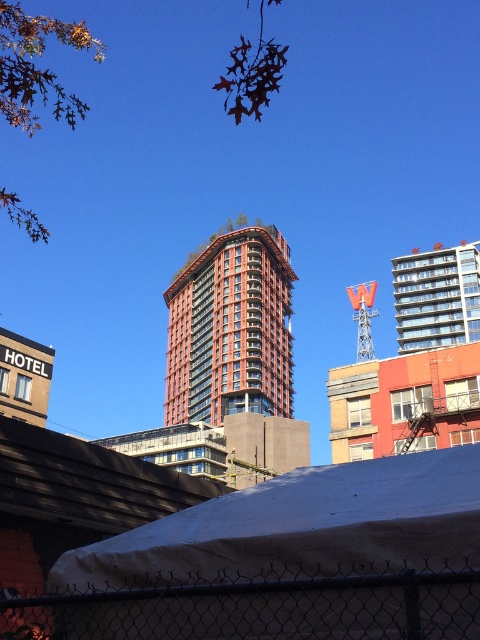
You are standing in front of the modern building and want to determine which of the two points, point (229, 627) or point (466, 301), is closer to you. Based on the scene, which point is nearer?

Point (229, 627) is closer to the viewer than point (466, 301).

You are a city planner assessing the space between the chain link fence at lower center and the glassy teal building at upper center. Which of the two has a smaller width?

The chain link fence at lower center has a lesser width compared to the glassy teal building at upper center.

You are an architect analyzing the urban layout. You observe the red brick building at center and the glassy teal building at upper center. Which building has a greater width according to the architectural measurements?

The red brick building at center has a greater width than the glassy teal building at upper center as stated in the description.